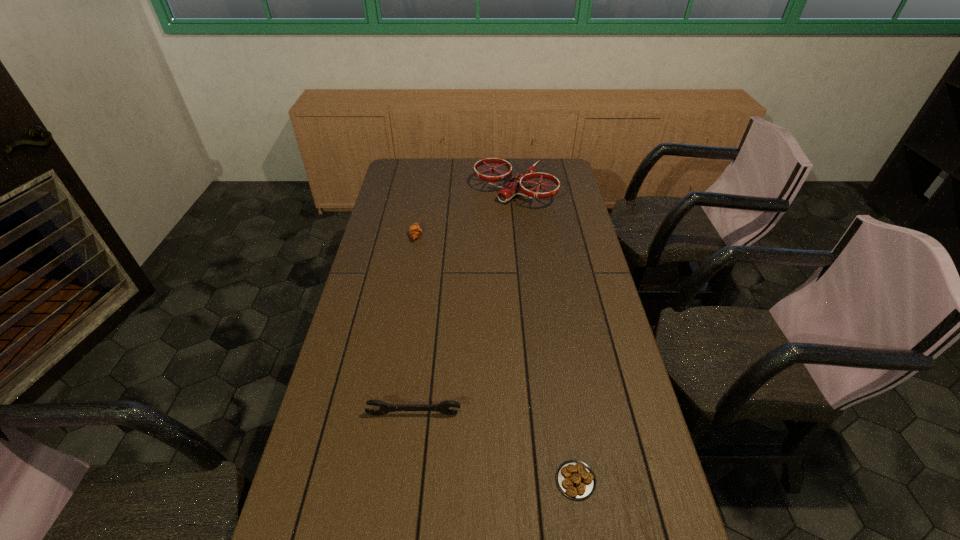
Image resolution: width=960 pixels, height=540 pixels. Find the location of `vacant area that lies between the third farthest object and the right pastry`. vacant area that lies between the third farthest object and the right pastry is located at coordinates (494, 447).

At what (x,y) coordinates should I click in order to perform the action: click on vacant space that is in between the shorter pastry and the third shortest object. Please return your answer as a coordinate pair (x, y). Looking at the image, I should click on (494, 447).

Locate an element on the screen. This screenshot has height=540, width=960. unoccupied position between the left pastry and the right pastry is located at coordinates (495, 357).

Choose which object is the third nearest neighbor to the third nearest object. Please provide its 2D coordinates. Your answer should be formatted as a tuple, i.e. [(x, y)], where the tuple contains the x and y coordinates of a point satisfying the conditions above.

[(575, 479)]

You are a GUI agent. You are given a task and a screenshot of the screen. Output one action in this format:
    pyautogui.click(x=<x>, y=<y>)
    Task: Click on the object that is the third closest to the shorter pastry
    Image resolution: width=960 pixels, height=540 pixels.
    Given the screenshot: What is the action you would take?
    pyautogui.click(x=514, y=185)

In order to click on vacant position in the image that satisfies the following two spatial constraints: 1. on the open ends of the nearer pastry; 2. on the right side of the wrench in this screenshot , I will do `click(405, 480)`.

At what (x,y) coordinates should I click in order to perform the action: click on blank area in the image that satisfies the following two spatial constraints: 1. on the back side of the nearer pastry; 2. on the front-facing side of the third nearest object. Please return your answer as a coordinate pair (x, y). The width and height of the screenshot is (960, 540). Looking at the image, I should click on (538, 235).

Locate an element on the screen. This screenshot has width=960, height=540. vacant position in the image that satisfies the following two spatial constraints: 1. on the back side of the nearest object; 2. on the front-facing side of the farther pastry is located at coordinates (538, 235).